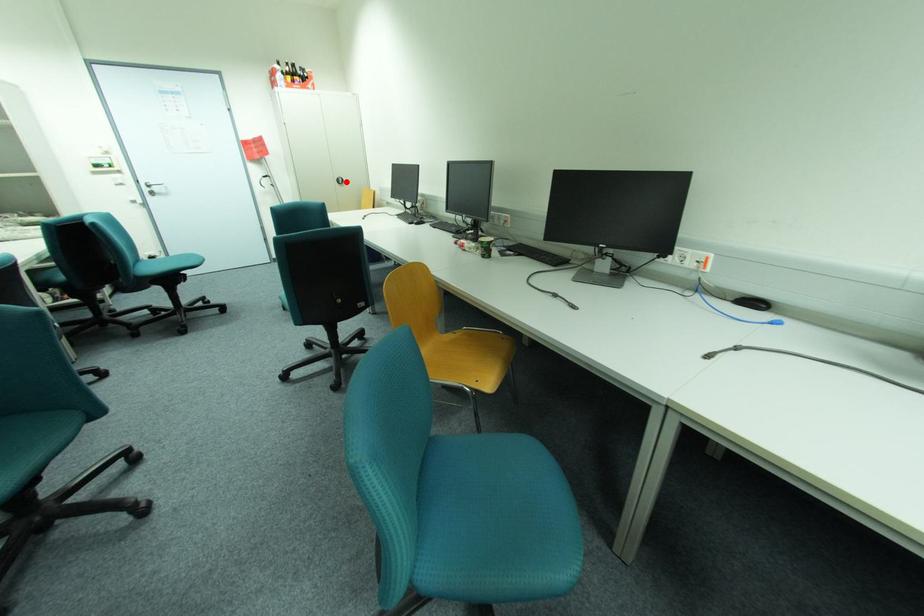
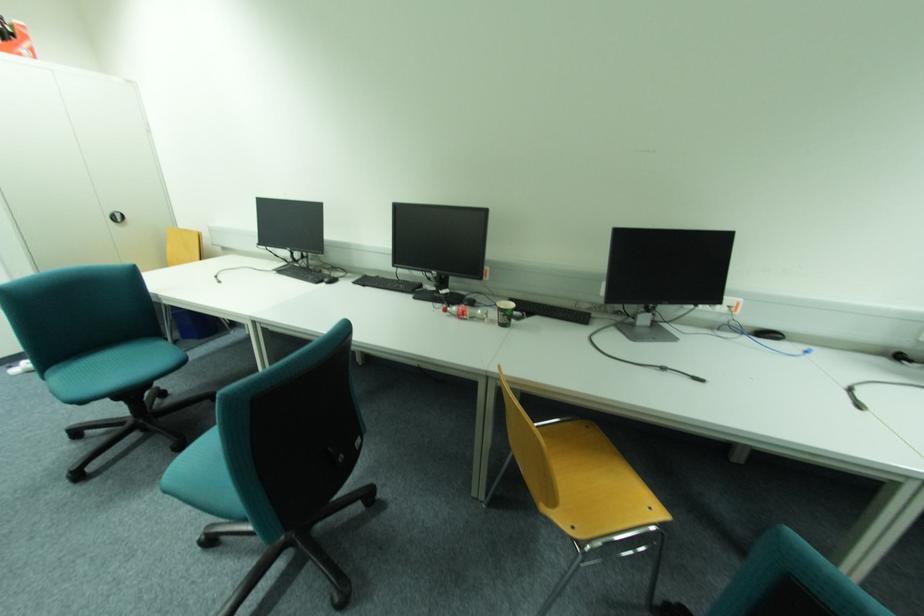
Question: I am providing you with two images of the same scene from different viewpoints. Given a red point in image1, look at the same physical point in image2. Is it:

Choices:
 (A) Closer to the viewpoint
 (B) Farther from the viewpoint

Answer: (B)